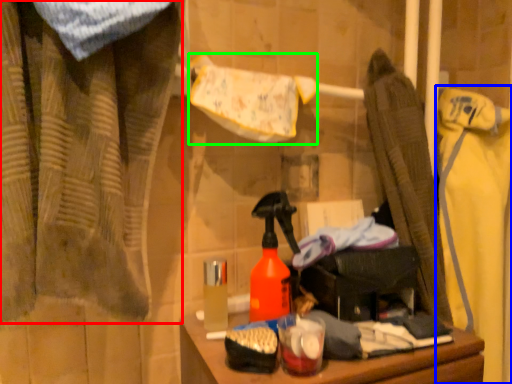
Question: Which is nearer to the curtain (highlighted by a red box)? clothing (highlighted by a blue box) or bath towel (highlighted by a green box).

Choices:
 (A) clothing
 (B) bath towel

Answer: (B)